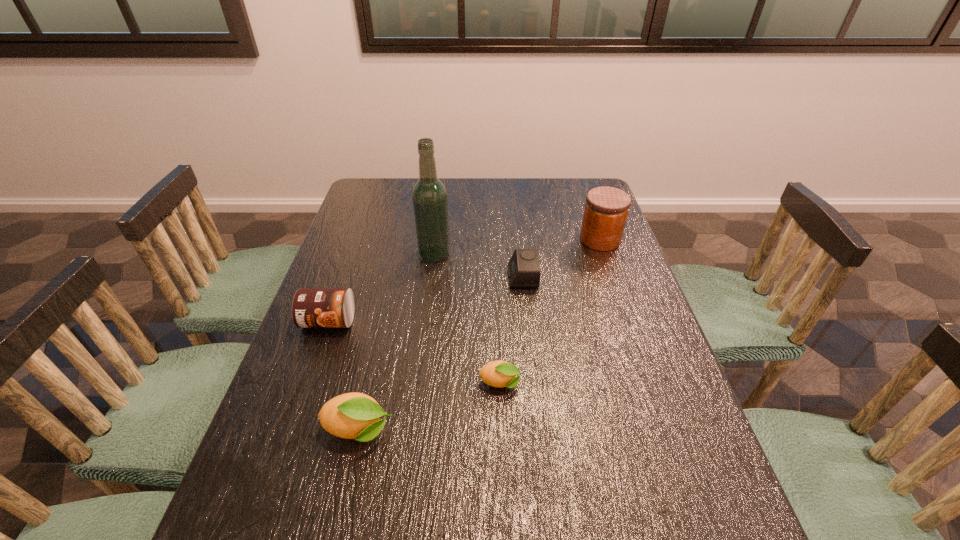
With all lemons evenly spaced, where should an extra lemon be placed on the right to continue the pattern? Please point out a vacant space. Please provide its 2D coordinates. Your answer should be formatted as a tuple, i.e. [(x, y)], where the tuple contains the x and y coordinates of a point satisfying the conditions above.

[(620, 345)]